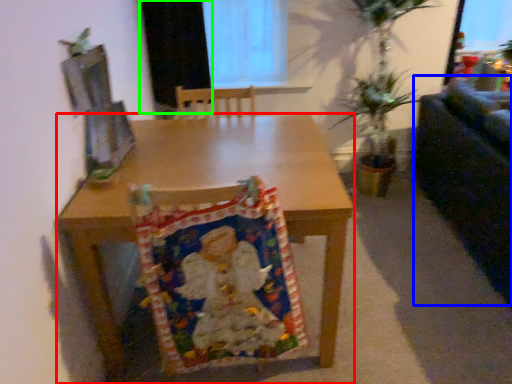
Question: Which is nearer to the desk (highlighted by a red box)? couch (highlighted by a blue box) or curtain (highlighted by a green box).

Choices:
 (A) couch
 (B) curtain

Answer: (B)